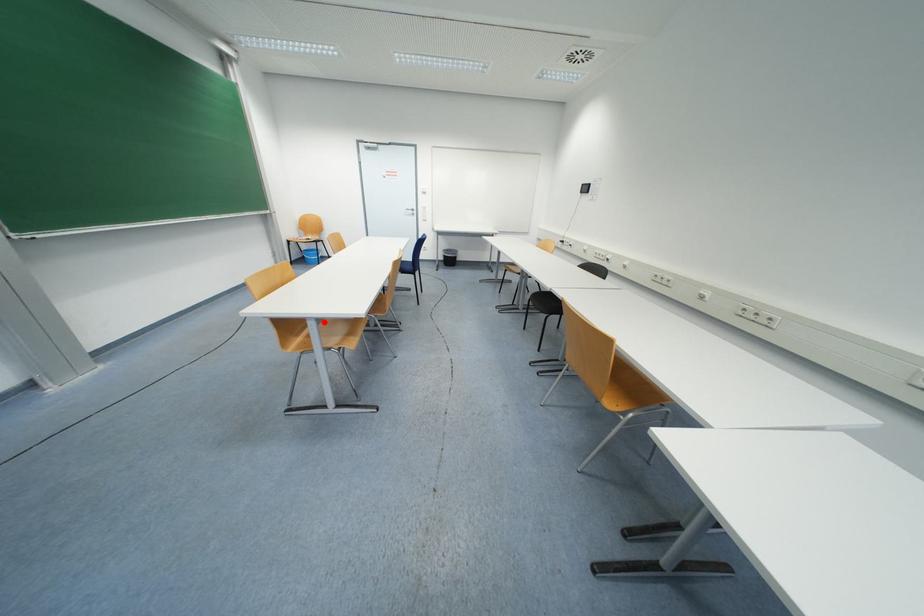
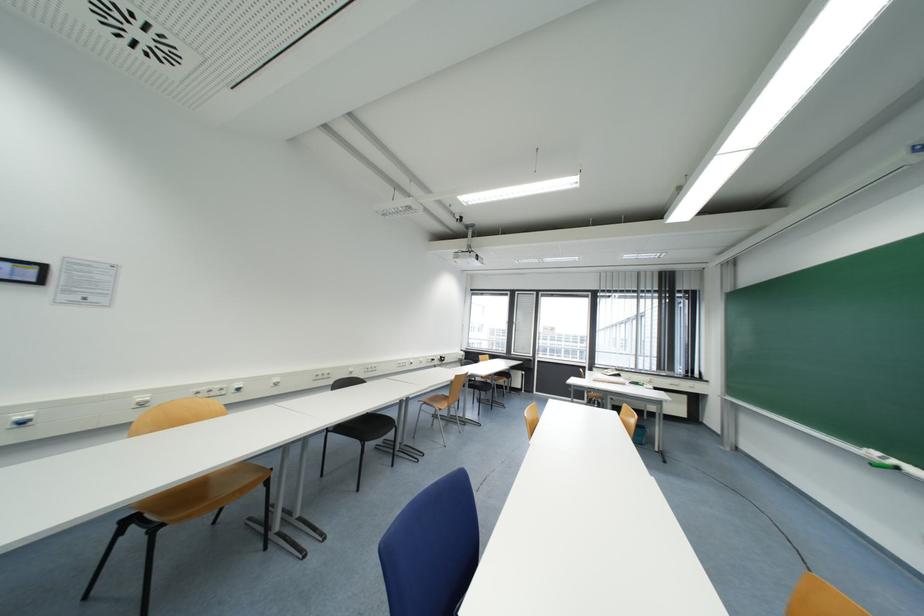
Question: I am providing you with two images of the same scene from different viewpoints. A red point is marked on the first image. Is the red point's position out of view in image 2?

Choices:
 (A) Yes
 (B) No

Answer: (A)